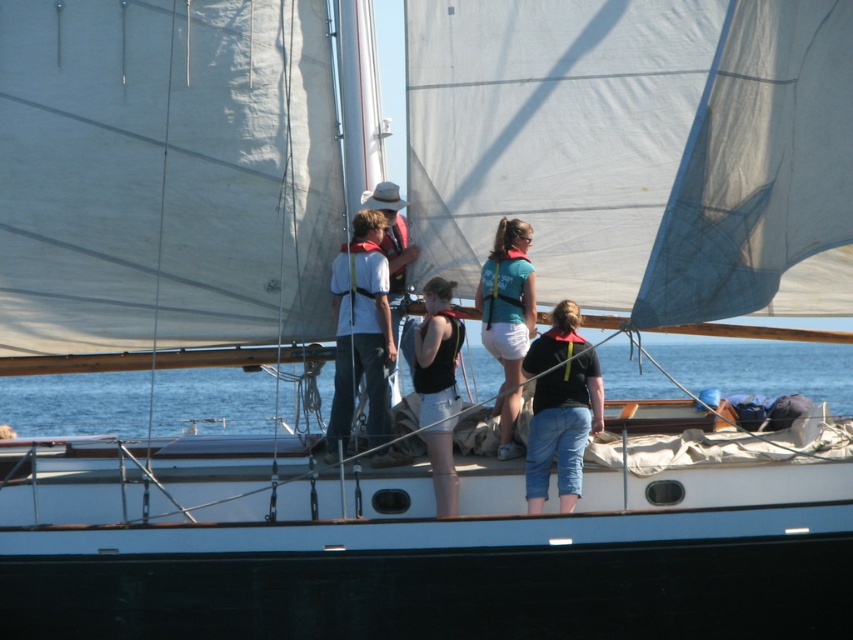
You are standing on the deck of the sailboat and want to reach a point marked at coordinates (439, 445). Considering the deck is 74.10 feet long from where you are standing, can you walk directly to that point without needing to move any obstacles?

The point at coordinates (439, 445) is 74.10 feet away from you. Since the deck is 74.10 feet long, you can walk directly to that point as long as there are no obstacles blocking your path along the deck.

You are standing on the deck of the sailboat and looking at two points marked on the deck. The first point is at coordinates point (660, 364) and the second point is at point (486, 321). Which point is closer to you?

Point (660, 364) is further to the viewer than point (486, 321), so the point closer to you is point (486, 321).